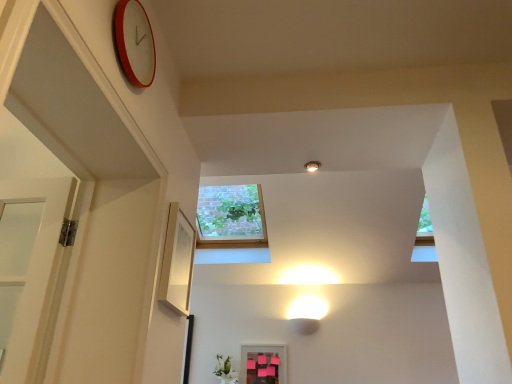
Question: Is white glossy light fixture at upper center bigger or smaller than green matte vase at lower center?

Choices:
 (A) small
 (B) big

Answer: (A)

Question: Is white glossy light fixture at upper center situated inside green matte vase at lower center or outside?

Choices:
 (A) outside
 (B) inside

Answer: (A)

Question: Which object is positioned farthest from the green matte vase at lower center?

Choices:
 (A) pink matte picture frame at lower center, the 2th picture frame from the top
 (B) red plastic clock at upper left
 (C) matte white picture frame at center-left, the 1th picture frame when ordered from left to right
 (D) white glossy light fixture at upper center

Answer: (B)

Question: Considering the real-world distances, which object is closest to the green matte vase at lower center?

Choices:
 (A) white glossy light fixture at upper center
 (B) matte white picture frame at center-left, which is the first picture frame from top to bottom
 (C) red plastic clock at upper left
 (D) pink matte picture frame at lower center, arranged as the 1th picture frame when ordered from the bottom

Answer: (D)